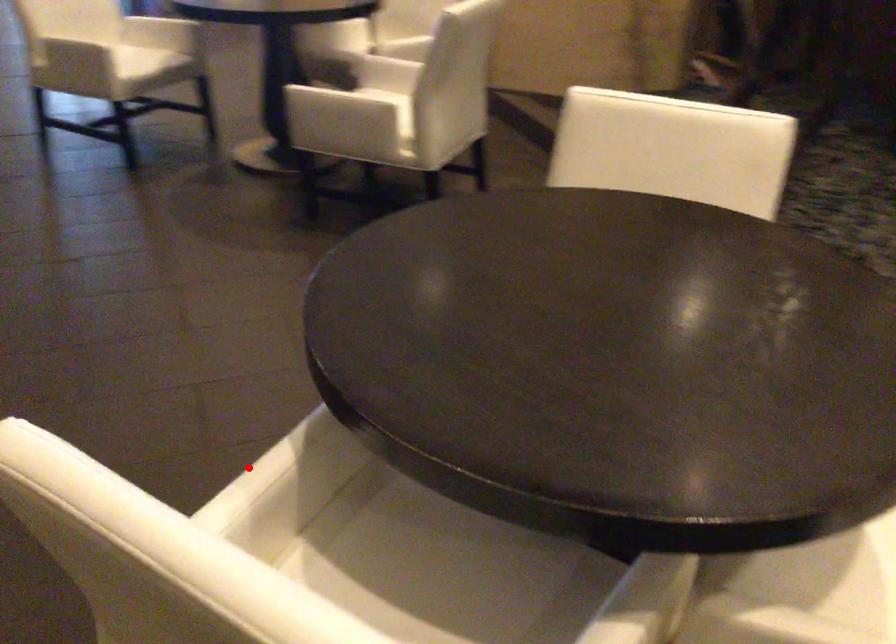
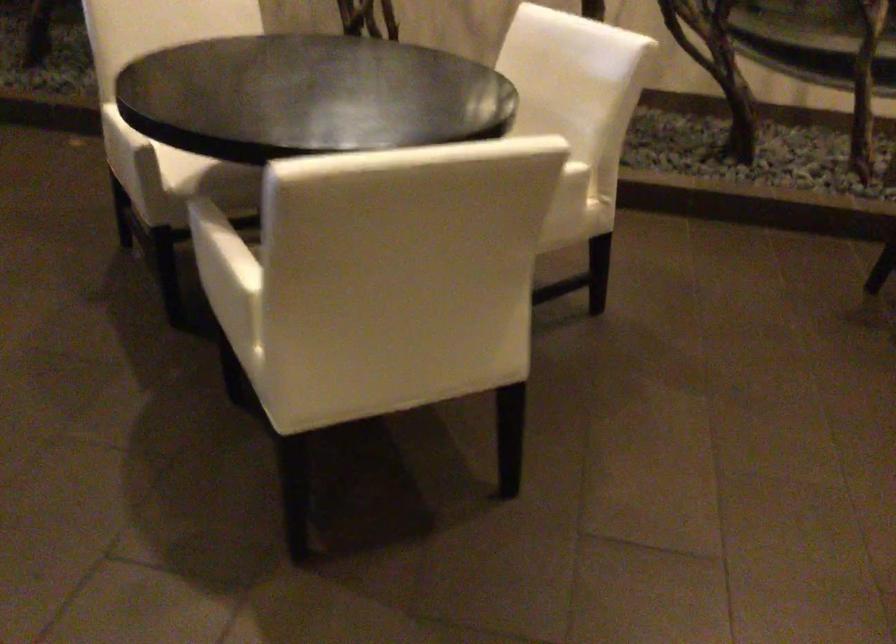
Find the pixel in the second image that matches the highlighted location in the first image.

(220, 249)